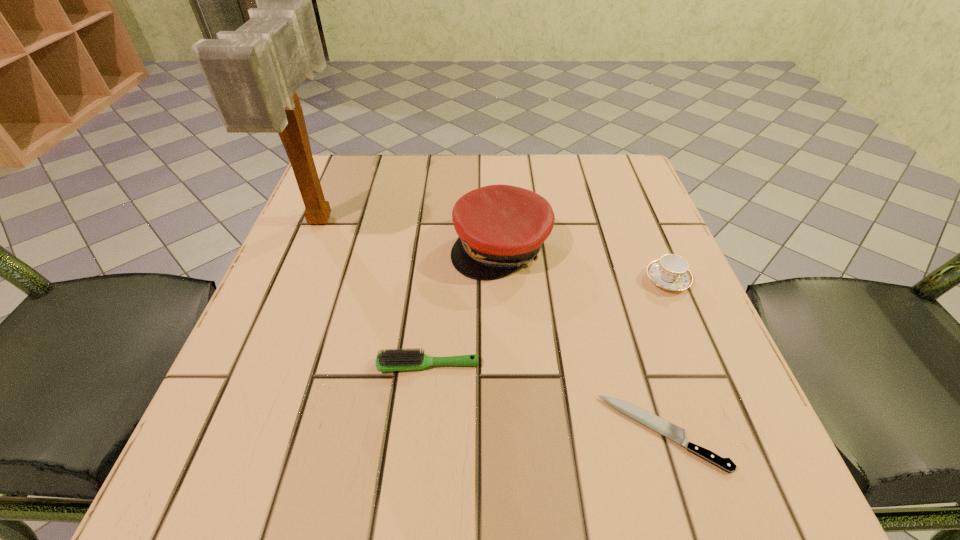
Find the location of a particular element. The image size is (960, 540). vacant space located on the side with the handle of the third shortest object is located at coordinates (708, 374).

You are a GUI agent. You are given a task and a screenshot of the screen. Output one action in this format:
    pyautogui.click(x=<x>, y=<y>)
    Task: Click on the vacant region located 0.200m on the back of the fourth tallest object
    
    Given the screenshot: What is the action you would take?
    pyautogui.click(x=437, y=268)

At what (x,y) coordinates should I click in order to perform the action: click on vacant area situated on the left of the shortest object. Please return your answer as a coordinate pair (x, y). Looking at the image, I should click on (362, 433).

At what (x,y) coordinates should I click in order to perform the action: click on object located in the far edge section of the desktop. Please return your answer as a coordinate pair (x, y). The width and height of the screenshot is (960, 540). Looking at the image, I should click on (253, 73).

Locate an element on the screen. This screenshot has width=960, height=540. object that is positioned at the near edge is located at coordinates (652, 421).

What are the coordinates of `object present at the left edge` in the screenshot? It's located at (253, 73).

Identify the location of teacup situated at the right edge. (670, 272).

Find the location of `steak knife present at the right edge`. steak knife present at the right edge is located at coordinates (652, 421).

Find the location of a particular element. object located in the far left corner section of the desktop is located at coordinates (253, 73).

Identify the location of object positioned at the near right corner. (652, 421).